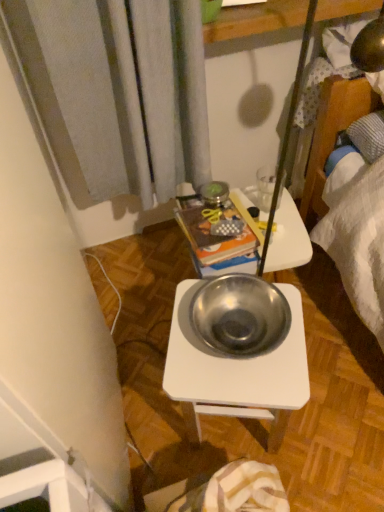
This screenshot has width=384, height=512. I want to click on vacant space underneath metallic silver bowl at center (from a real-world perspective), so point(236,328).